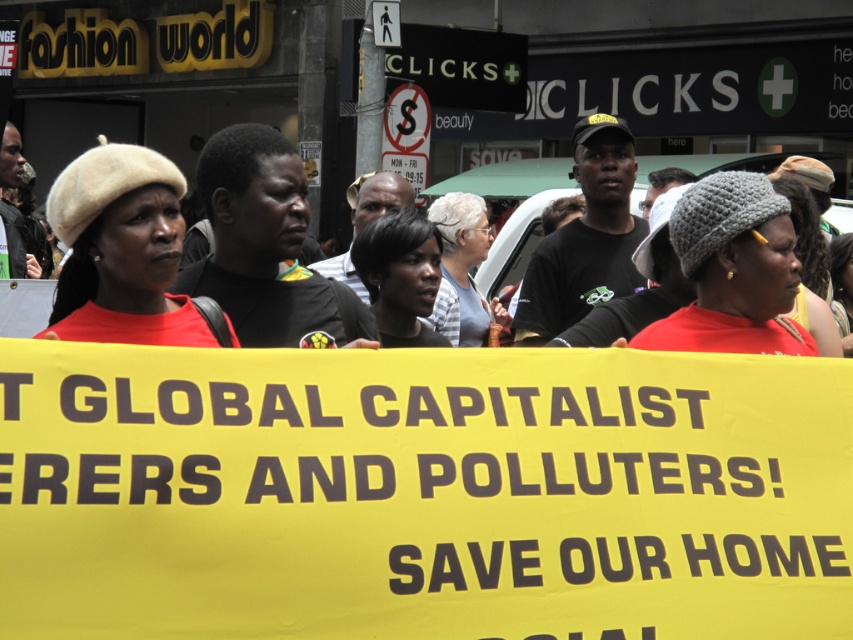
You are a photographer at the protest scene. You want to capture a photo that includes both the gray knitted hat at center and the gray knitted hat at upper center. Which gray knitted hat should appear smaller in the photo?

The gray knitted hat at center is shorter than the gray knitted hat at upper center, so it will appear smaller in the photo.

You are a photographer trying to capture a clear shot of the beige felt beret at left and the dark brown hair at center. Which object will appear larger in your photo?

The beige felt beret at left is closer to the viewer than the dark brown hair at center, so it will appear larger in the photo.